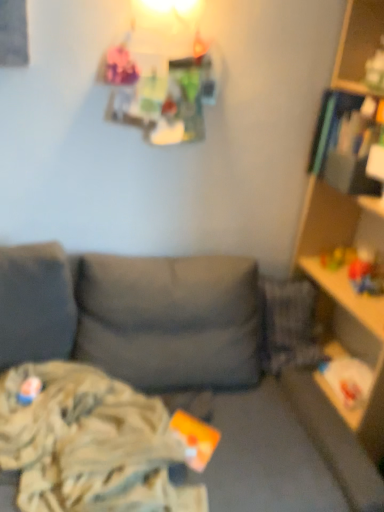
Question: Is camouflage fabric blanket at lower left bigger or smaller than rubberized yellow toy at right, which is the second toy from left to right?

Choices:
 (A) big
 (B) small

Answer: (A)

Question: Do you think camouflage fabric blanket at lower left is within rubberized yellow toy at right, which is the second toy from bottom to top, or outside of it?

Choices:
 (A) inside
 (B) outside

Answer: (B)

Question: Which object is positioned farthest from the rubberized yellow toy at right, which is counted as the first toy, starting from the right?

Choices:
 (A) wooden shelf at right
 (B) matte plastic toy at lower left, the 1th toy positioned from the front
 (C) camouflage fabric blanket at lower left

Answer: (B)

Question: Based on their relative distances, which object is nearer to the camouflage fabric blanket at lower left?

Choices:
 (A) rubberized yellow toy at right, acting as the 1th toy starting from the top
 (B) wooden shelf at right
 (C) matte plastic toy at lower left, acting as the second toy starting from the top

Answer: (C)